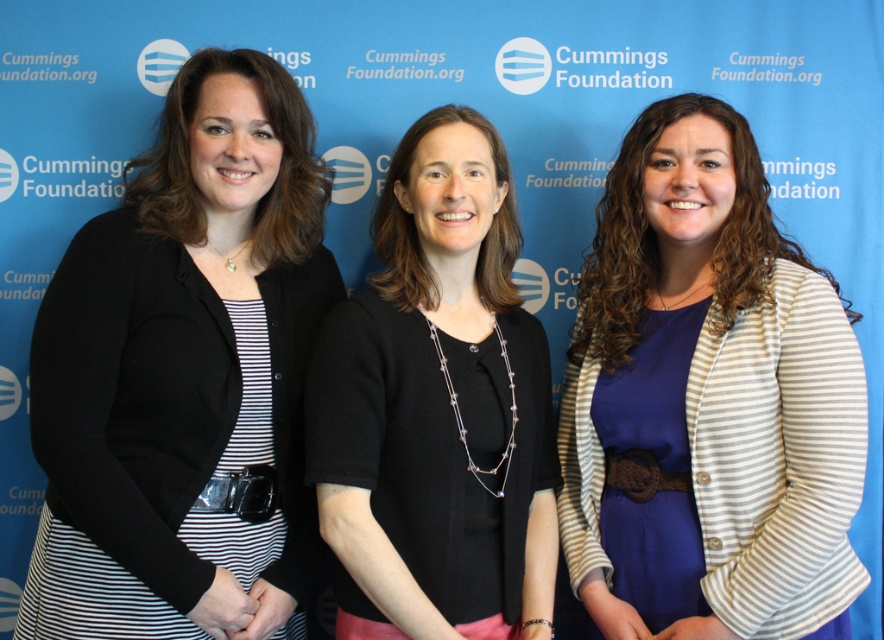
Which is more to the left, striped fabric dress at center or black matte sweater at center?

Positioned to the left is black matte sweater at center.

Is point (676, 268) in front of point (326, 342)?

No, it is not.

Is point (601, 314) less distant than point (427, 148)?

No, it is behind (427, 148).

In order to click on striped fabric dress at center in this screenshot , I will do [x=706, y=397].

Does black matte blazer at left appear on the left side of striped fabric dress at center?

Indeed, black matte blazer at left is positioned on the left side of striped fabric dress at center.

Which is below, black matte blazer at left or striped fabric dress at center?

Positioned lower is striped fabric dress at center.

Locate an element on the screen. The height and width of the screenshot is (640, 884). black matte blazer at left is located at coordinates (185, 372).

Is black matte blazer at left further to camera compared to black matte sweater at center?

No, black matte blazer at left is closer to the viewer.

Is black matte blazer at left above black matte sweater at center?

Correct, black matte blazer at left is located above black matte sweater at center.

Between point (96, 307) and point (492, 148), which one is positioned in front?

Point (96, 307)

Locate an element on the screen. This screenshot has height=640, width=884. black matte blazer at left is located at coordinates (185, 372).